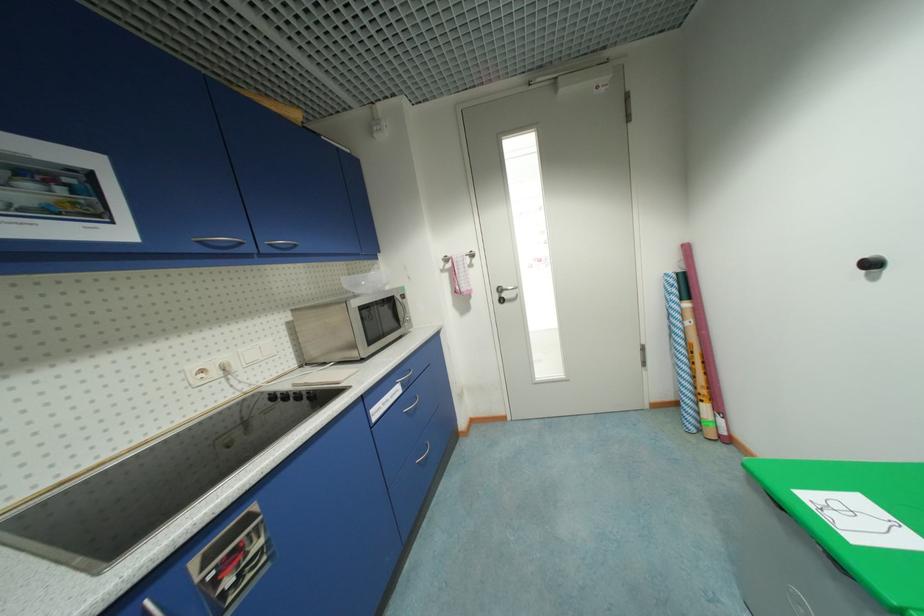
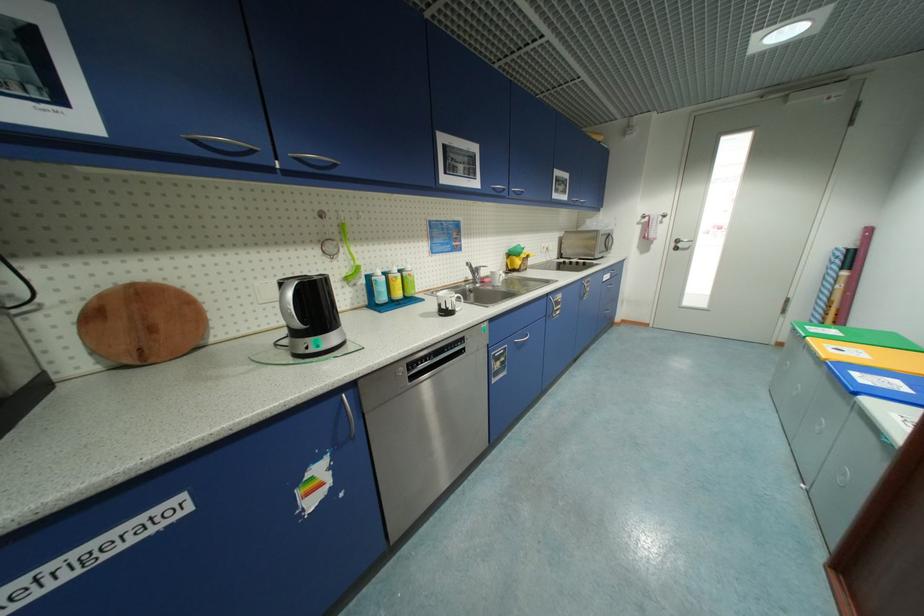
Where in the second image is the point corresponding to (505,291) from the first image?

(684, 241)